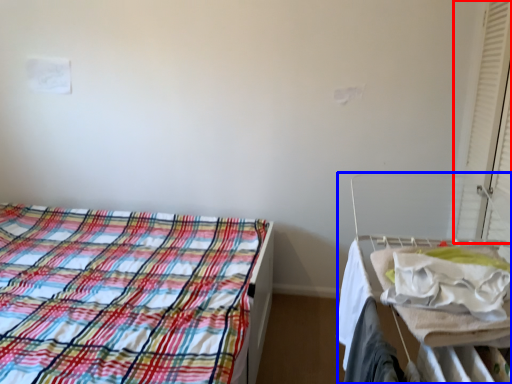
Question: Which of the following is the closest to the observer, curtain (highlighted by a red box) or hospital bed (highlighted by a blue box)?

Choices:
 (A) curtain
 (B) hospital bed

Answer: (B)